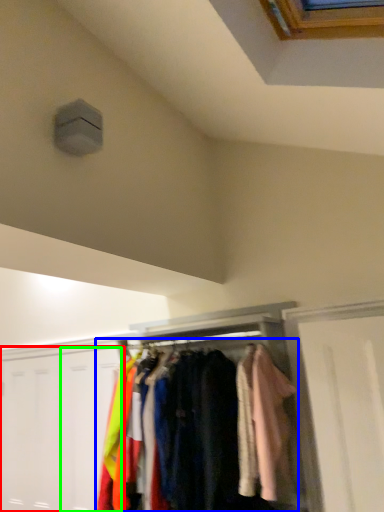
Question: Estimate the real-world distances between objects in this image. Which object is farther from door (highlighted by a red box), garment (highlighted by a blue box) or door (highlighted by a green box)?

Choices:
 (A) garment
 (B) door

Answer: (A)